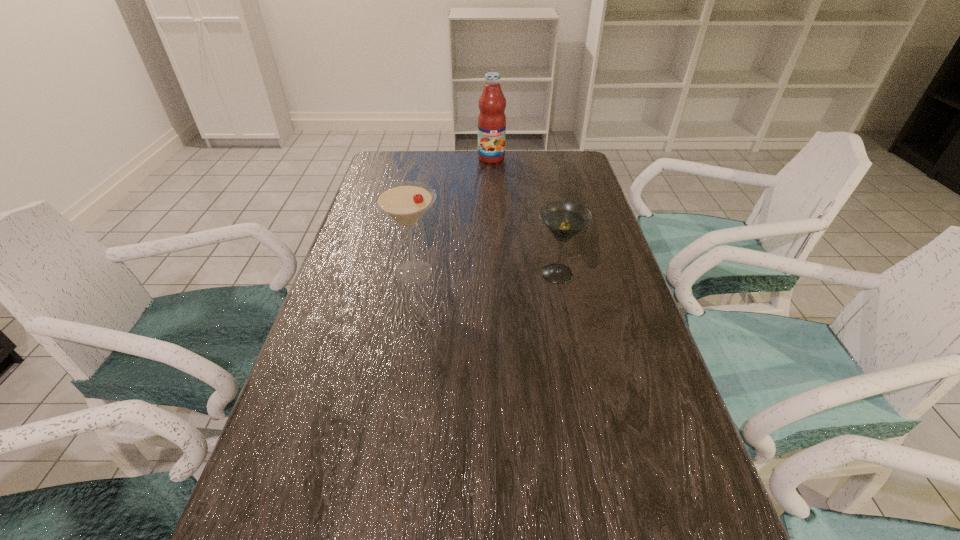
What are the coordinates of `blank area in the image that satisfies the following two spatial constraints: 1. on the front label of the right martini; 2. on the right side of the farthest object` in the screenshot? It's located at [496, 274].